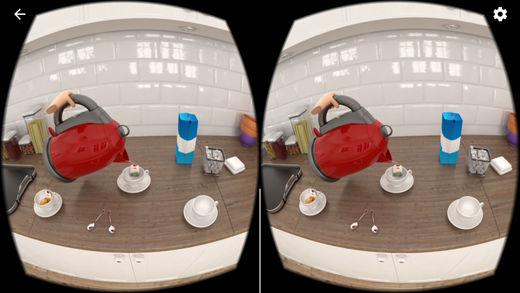
The height and width of the screenshot is (293, 520). Identify the location of pitcher. (98, 152), (332, 146).